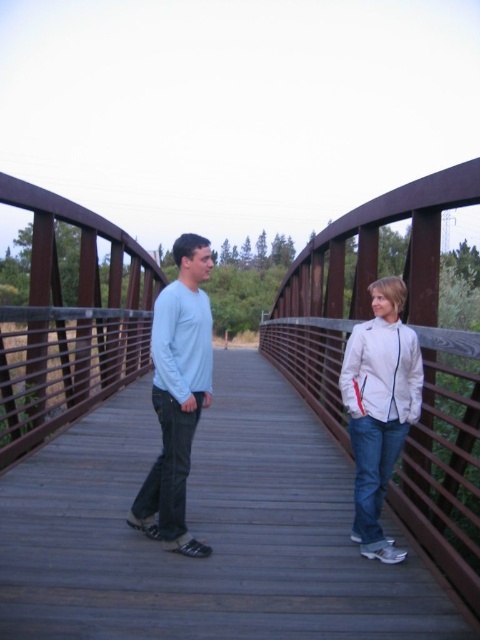
Which of these two, matte light blue long-sleeve shirt at center or white matte jacket at center, stands taller?

Standing taller between the two is white matte jacket at center.

Does matte light blue long-sleeve shirt at center have a lesser width compared to white matte jacket at center?

Correct, matte light blue long-sleeve shirt at center's width is less than white matte jacket at center's.

Where is `matte light blue long-sleeve shirt at center`? This screenshot has width=480, height=640. matte light blue long-sleeve shirt at center is located at coordinates tap(178, 396).